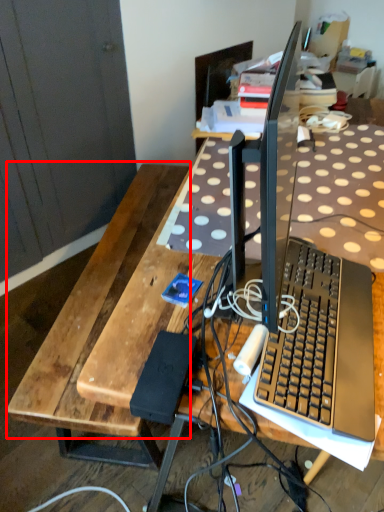
Question: From the image's perspective, what is the correct spatial positioning of wood (annotated by the red box) in reference to computer keyboard?

Choices:
 (A) above
 (B) below

Answer: (B)